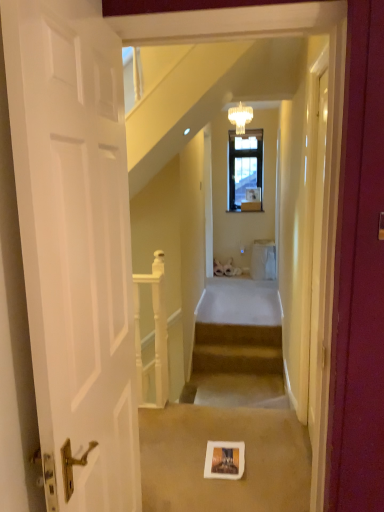
At what (x,y) coordinates should I click in order to perform the action: click on free location above white cardboard picture frame at center (from a real-world perspective). Please return your answer as a coordinate pair (x, y). Looking at the image, I should click on (224, 456).